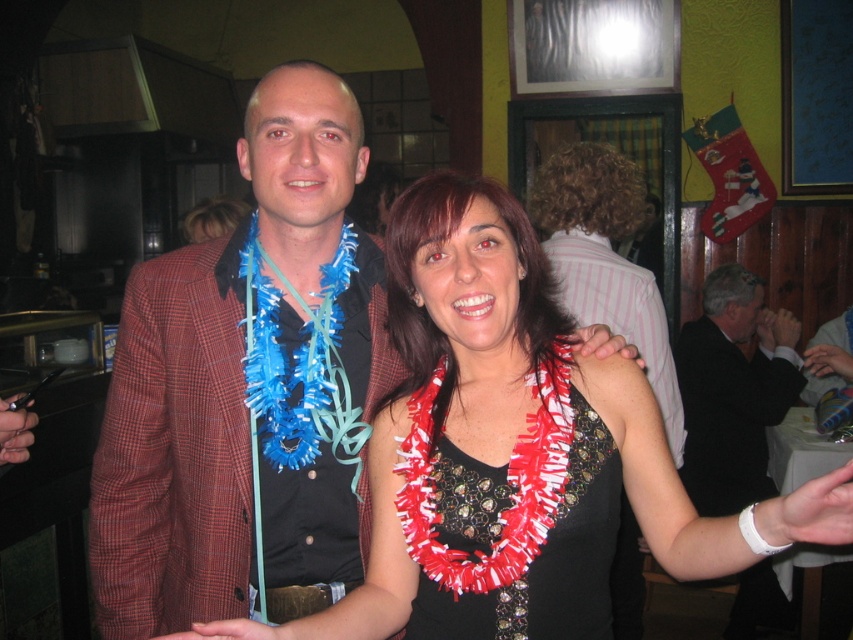
You are standing in the restaurant and want to take a photo of the plaid fabric jacket at center. Where should you aim your camera to capture it?

You should aim your camera at point (241, 384) to capture the plaid fabric jacket at center.

You are taking a photo of the scene and want to focus on both the point at (219, 355) and the point at (605, 307). Which point should you adjust your focus to first to ensure both are in clear view?

You should focus on point (219, 355) first since it is closer to the camera. By focusing on the closer point, the farther point (605, 307) will also come into focus due to the depth of field.